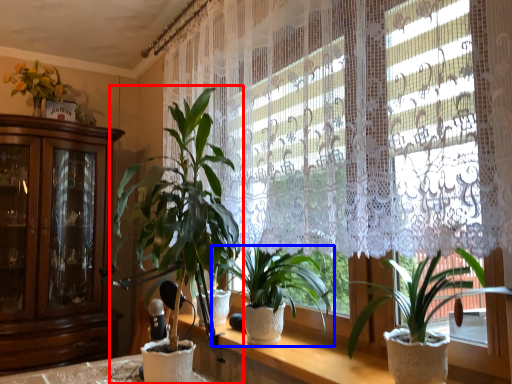
Question: Which point is further to the camera, houseplant (highlighted by a red box) or houseplant (highlighted by a blue box)?

Choices:
 (A) houseplant
 (B) houseplant

Answer: (B)